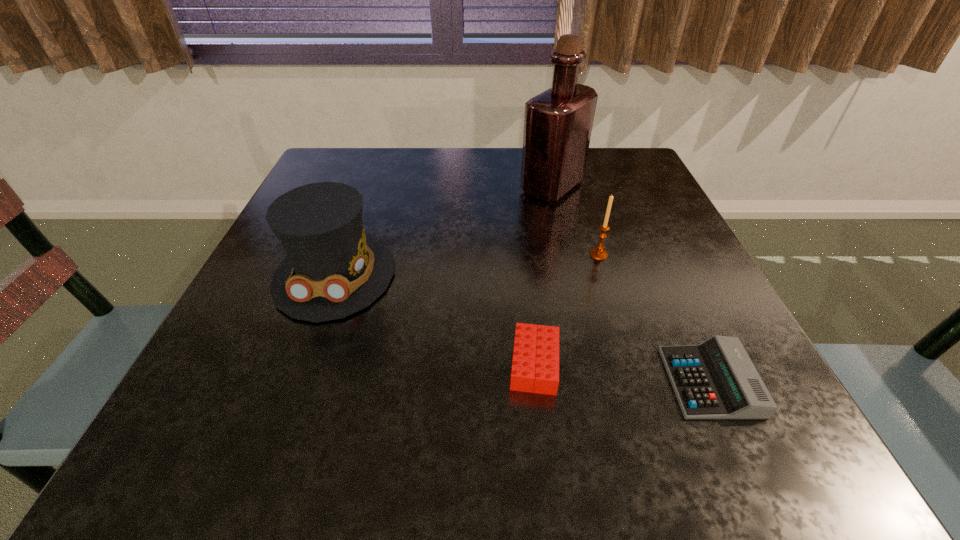
Identify the location of blank area located 0.140m on the right of the fourth tallest object. The height and width of the screenshot is (540, 960). (654, 364).

The height and width of the screenshot is (540, 960). In order to click on blank area located 0.380m on the back of the calculator in this screenshot , I will do `click(633, 212)`.

Locate an element on the screen. This screenshot has width=960, height=540. object that is at the far edge is located at coordinates (558, 123).

I want to click on object at the near edge, so click(x=716, y=379).

Where is `object situated at the left edge`? object situated at the left edge is located at coordinates (332, 269).

Find the location of a particular element. object located at the right edge is located at coordinates (716, 379).

The height and width of the screenshot is (540, 960). I want to click on object located at the near right corner, so click(x=716, y=379).

This screenshot has height=540, width=960. Find the location of `free space at the far edge of the desktop`. free space at the far edge of the desktop is located at coordinates (487, 184).

This screenshot has height=540, width=960. In order to click on free point at the left edge in this screenshot , I will do `click(271, 351)`.

This screenshot has width=960, height=540. In order to click on blank space at the right edge of the desktop in this screenshot , I will do pos(775,402).